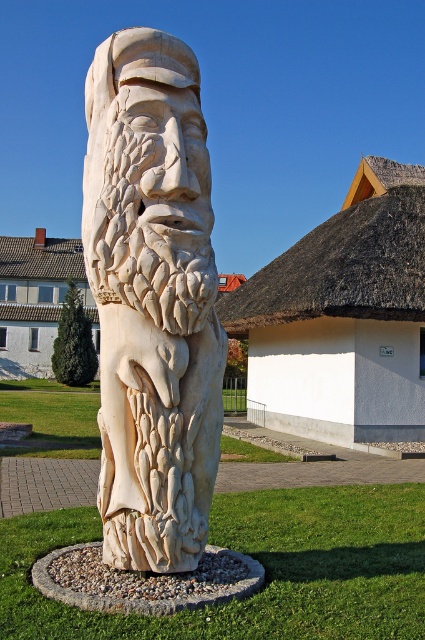
Question: Estimate the real-world distances between objects in this image. Which object is farther from the white carved wood statue at center?

Choices:
 (A) white thatched roof at upper center
 (B) white tiled roof at upper center

Answer: (B)

Question: Does white thatched roof at upper center have a smaller size compared to white tiled roof at upper center?

Choices:
 (A) no
 (B) yes

Answer: (B)

Question: Is white carved wood statue at center positioned at the back of white tiled roof at upper center?

Choices:
 (A) no
 (B) yes

Answer: (A)

Question: Which of the following is the closest to the observer?

Choices:
 (A) white thatched roof at upper center
 (B) white carved wood statue at center

Answer: (B)

Question: Does white thatched roof at upper center come behind white tiled roof at upper center?

Choices:
 (A) no
 (B) yes

Answer: (A)

Question: Which point appears farthest from the camera in this image?

Choices:
 (A) (421, 225)
 (B) (190, 540)

Answer: (A)